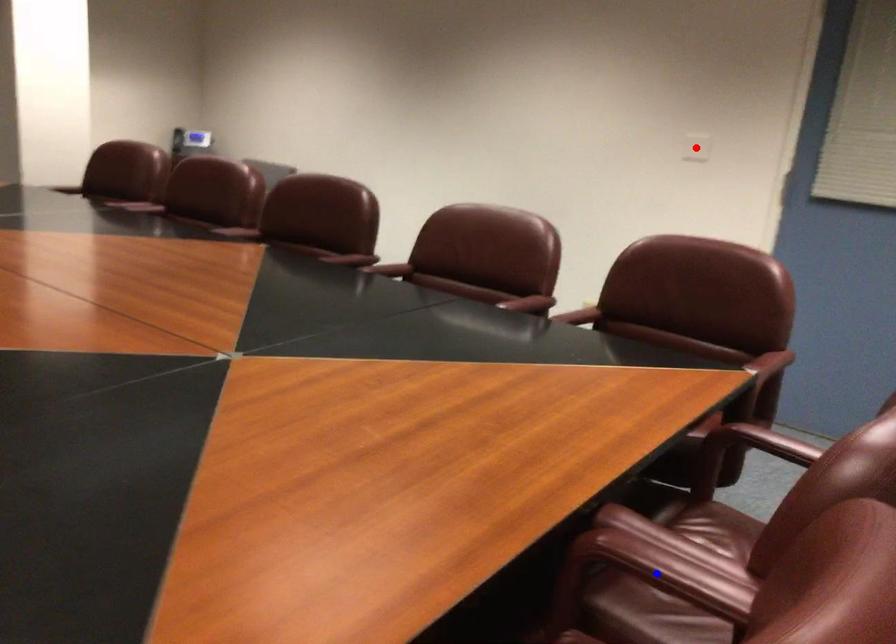
Question: In the image, two points are highlighted. Which point is nearer to the camera? Reply with the corresponding letter.

Choices:
 (A) blue point
 (B) red point

Answer: (A)